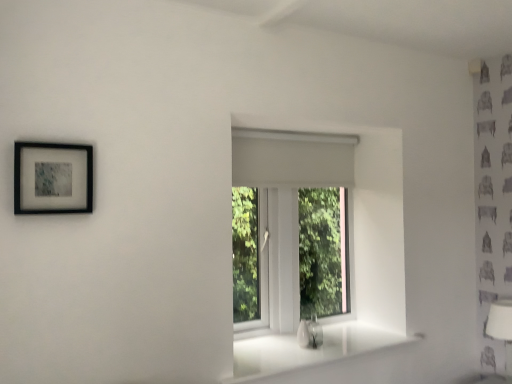
Question: Considering the positions of white glossy sink at lower center and black matte picture frame at upper left in the image, is white glossy sink at lower center bigger or smaller than black matte picture frame at upper left?

Choices:
 (A) small
 (B) big

Answer: (A)

Question: Which is correct: white glossy sink at lower center is inside black matte picture frame at upper left, or outside of it?

Choices:
 (A) outside
 (B) inside

Answer: (A)

Question: Estimate the real-world distances between objects in this image. Which object is closer to the white fabric lampshade at lower right?

Choices:
 (A) white matte window at center
 (B) white glossy window sill at center
 (C) white glossy sink at lower center
 (D) black matte picture frame at upper left

Answer: (B)

Question: Which of these objects is positioned closest to the white matte window at center?

Choices:
 (A) white fabric lampshade at lower right
 (B) white glossy sink at lower center
 (C) black matte picture frame at upper left
 (D) white glossy window sill at center

Answer: (D)